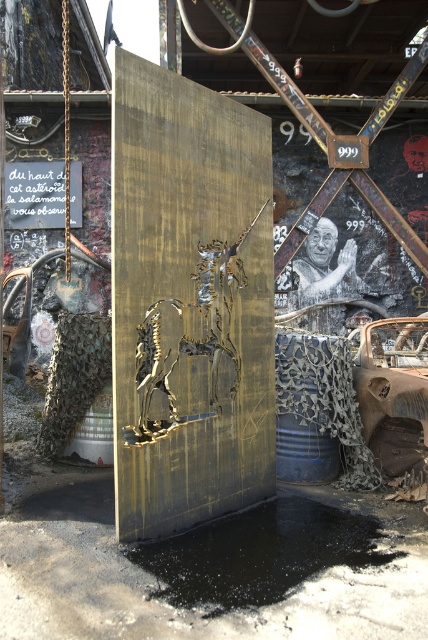
Is the position of black glossy puddle at lower center more distant than that of gold metallic horse at center?

No, it is in front of gold metallic horse at center.

Between point (172, 577) and point (190, 384), which one is positioned behind?

The point (190, 384) is behind.

Where is `black glossy puddle at lower center`? black glossy puddle at lower center is located at coordinates (258, 554).

Between black glossy puddle at lower center and rusty metal car at lower right, which one is positioned higher?

rusty metal car at lower right is above.

Can you confirm if black glossy puddle at lower center is positioned to the right of rusty metal car at lower right?

No, black glossy puddle at lower center is not to the right of rusty metal car at lower right.

Who is more distant from viewer, (232, 573) or (391, 362)?

The point (391, 362) is behind.

At what (x,y) coordinates should I click in order to perform the action: click on black glossy puddle at lower center. Please return your answer as a coordinate pair (x, y). This screenshot has height=640, width=428. Looking at the image, I should click on (258, 554).

Can you confirm if gold metallic horse at center is positioned to the right of rusty metal car at lower right?

In fact, gold metallic horse at center is to the left of rusty metal car at lower right.

Is gold metallic horse at center positioned before rusty metal car at lower right?

That is True.

At what (x,y) coordinates should I click in order to perform the action: click on gold metallic horse at center. Please return your answer as a coordinate pair (x, y). The width and height of the screenshot is (428, 640). Looking at the image, I should click on (187, 348).